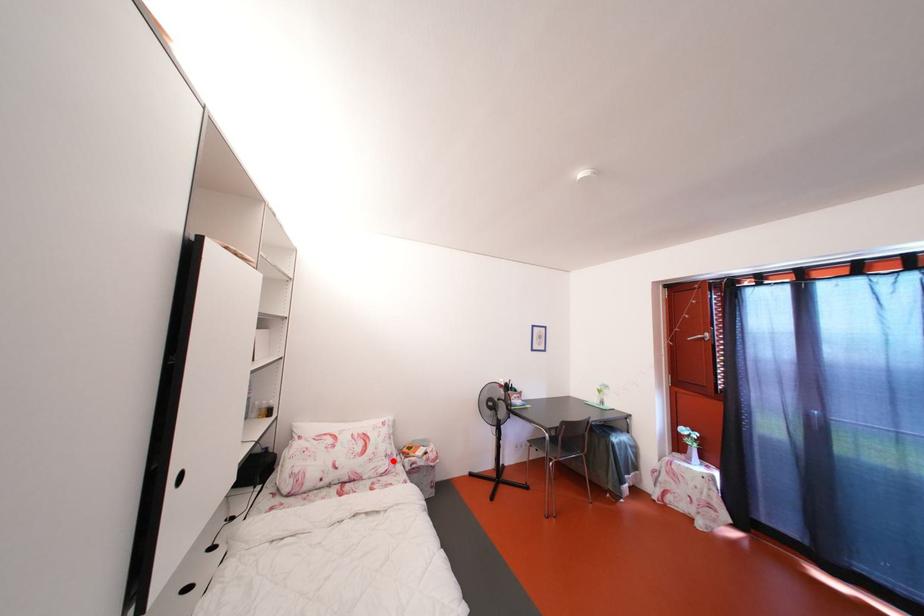
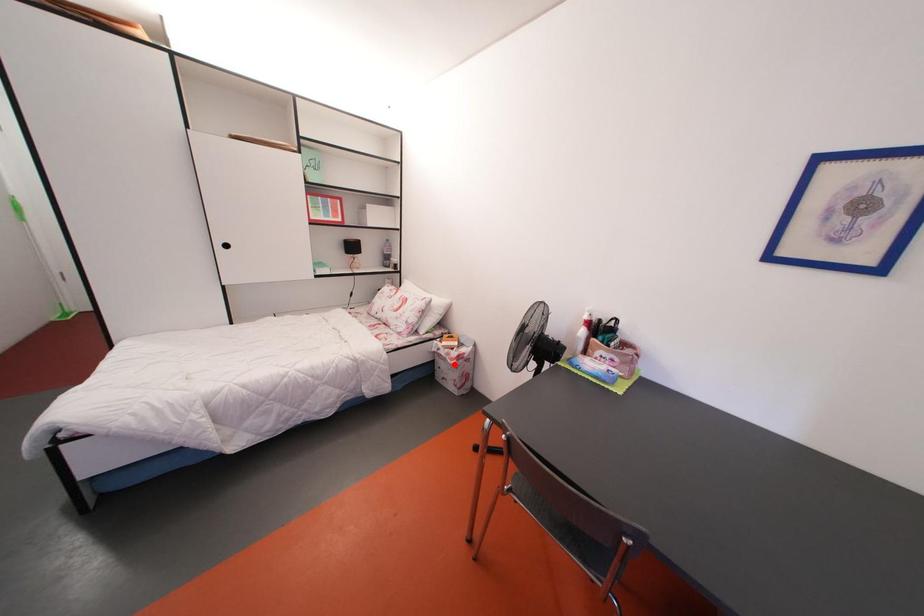
I am providing you with two images of the same scene from different viewpoints. A red point is marked on the first image and another point is marked on the second image. Is the marked point in image1 the same physical position as the marked point in image2?

No